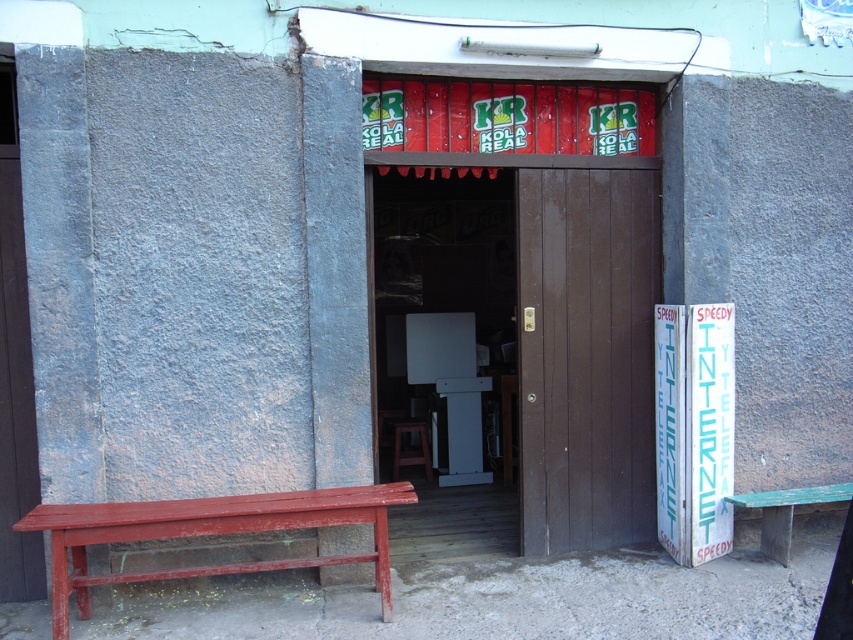
Which is in front, point (541, 392) or point (173, 528)?

Positioned in front is point (173, 528).

Can you confirm if brown wooden door at center is positioned to the left of rustic wood bench at left?

Incorrect, brown wooden door at center is not on the left side of rustic wood bench at left.

Does point (587, 362) lie behind point (175, 524)?

Yes.

This screenshot has height=640, width=853. In order to click on brown wooden door at center in this screenshot , I will do `click(585, 355)`.

Is rustic wood bench at left to the left of brown wooden stool at center from the viewer's perspective?

Correct, you'll find rustic wood bench at left to the left of brown wooden stool at center.

Does rustic wood bench at left have a lesser width compared to brown wooden stool at center?

No, rustic wood bench at left is not thinner than brown wooden stool at center.

Who is more forward, (207, 502) or (421, 442)?

Point (207, 502)

The width and height of the screenshot is (853, 640). Find the location of `rustic wood bench at left`. rustic wood bench at left is located at coordinates (207, 534).

Does rustic wood bench at left have a greater width compared to green wooden bench at lower right?

Correct, the width of rustic wood bench at left exceeds that of green wooden bench at lower right.

Is point (178, 570) positioned behind point (790, 531)?

No, it is not.

Identify the location of rustic wood bench at left. The height and width of the screenshot is (640, 853). (207, 534).